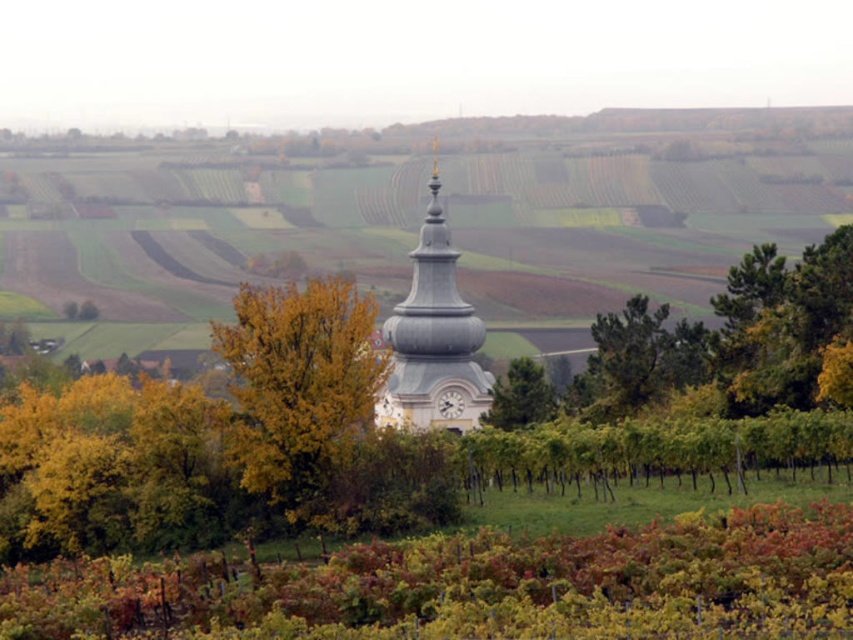
Find the location of a particular element. yellow leafy tree at center is located at coordinates (299, 387).

Between yellow leafy tree at center and green leafy tree at center, which one appears on the left side from the viewer's perspective?

yellow leafy tree at center is more to the left.

What do you see at coordinates (299, 387) in the screenshot? Image resolution: width=853 pixels, height=640 pixels. I see `yellow leafy tree at center` at bounding box center [299, 387].

Locate an element on the screen. yellow leafy tree at center is located at coordinates (299, 387).

Can you confirm if white stucco clock tower at center is positioned above green leafy tree at center?

Yes.

Is white stucco clock tower at center below green leafy tree at center?

Incorrect, white stucco clock tower at center is not positioned below green leafy tree at center.

Image resolution: width=853 pixels, height=640 pixels. Describe the element at coordinates (433, 339) in the screenshot. I see `white stucco clock tower at center` at that location.

Image resolution: width=853 pixels, height=640 pixels. In order to click on white stucco clock tower at center in this screenshot , I will do `click(433, 339)`.

Can you confirm if yellow leafy tree at center is positioned to the left of white stucco clock tower at center?

Indeed, yellow leafy tree at center is positioned on the left side of white stucco clock tower at center.

Which is behind, point (315, 396) or point (445, 376)?

The point (445, 376) is more distant.

Identify the location of yellow leafy tree at center. This screenshot has height=640, width=853. (299, 387).